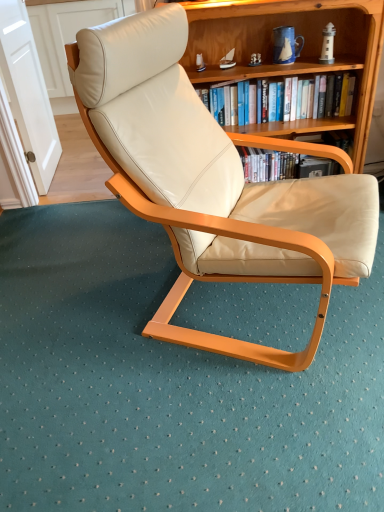
Question: Is point (332, 117) closer or farther from the camera than point (145, 69)?

Choices:
 (A) farther
 (B) closer

Answer: (A)

Question: From the image's perspective, is hardcover book at upper center positioned above or below matte cream leather chair at center?

Choices:
 (A) above
 (B) below

Answer: (A)

Question: Based on their relative distances, which object is nearer to the matte cream leather chair at center?

Choices:
 (A) hardcover book at upper center
 (B) wooden bookshelf at upper center

Answer: (B)

Question: Which object is the farthest from the wooden bookshelf at upper center?

Choices:
 (A) matte cream leather chair at center
 (B) hardcover book at upper center

Answer: (A)